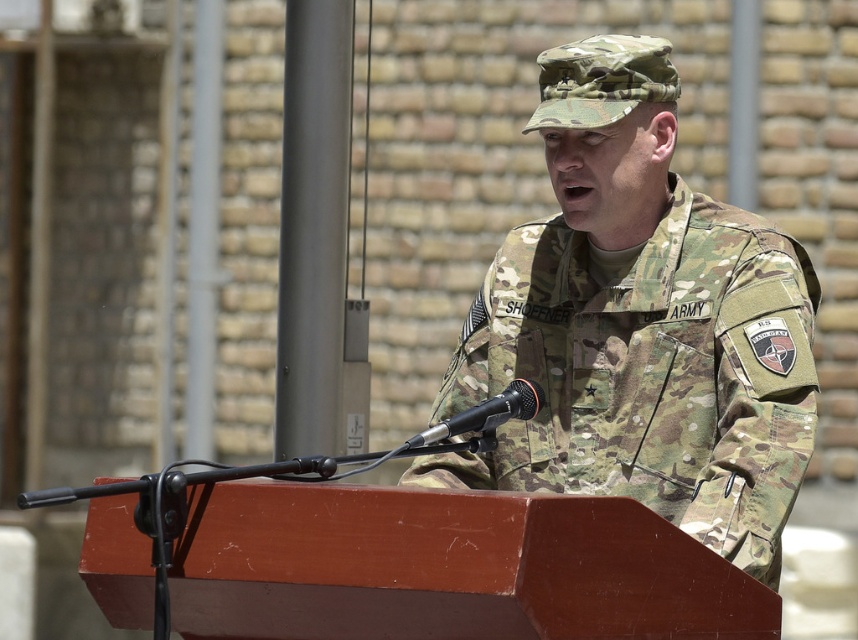
You are an event organizer setting up a stage for a military event. You need to ensure that the camo uniform at center and the black matte microphone at center are positioned correctly. According to the image, which object is placed higher on the stage?

The camo uniform at center is located above the black matte microphone at center, so the camo uniform at center is placed higher on the stage.